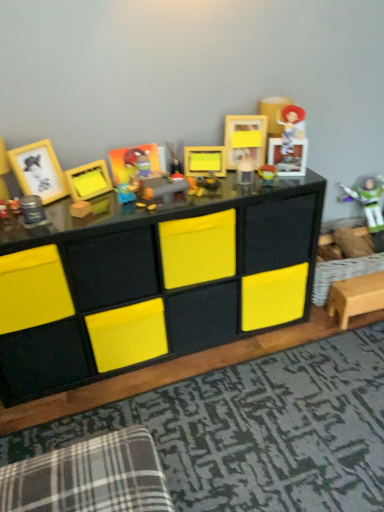
Where is `plaid fabric swivel chair at lower left`? The image size is (384, 512). plaid fabric swivel chair at lower left is located at coordinates (90, 477).

Where is `matte yellow plush toy at center, marked as the 4th toy in a back-to-front arrangement`? This screenshot has height=512, width=384. matte yellow plush toy at center, marked as the 4th toy in a back-to-front arrangement is located at coordinates (126, 193).

Image resolution: width=384 pixels, height=512 pixels. Find the location of `matte plastic picture frame at center, which ranks as the third picture frame in left-to-right order`. matte plastic picture frame at center, which ranks as the third picture frame in left-to-right order is located at coordinates (134, 162).

Describe the element at coordinates (134, 162) in the screenshot. The width and height of the screenshot is (384, 512). I see `matte plastic picture frame at center, the third picture frame viewed from the right` at that location.

Where is `plaid fabric swivel chair at lower left`? Image resolution: width=384 pixels, height=512 pixels. plaid fabric swivel chair at lower left is located at coordinates [90, 477].

From a real-world perspective, starting from the metallic silver canister at left, the fifth toy in the right-to-left sequence, which picture frame is the 5th one vertically above it? Please provide its 2D coordinates.

[(245, 139)]

Would you say matte yellow picture frame at upper center, marked as the fifth picture frame in a left-to-right arrangement, is outside metallic silver canister at left, the first toy when ordered from left to right?

Yes.

How many degrees apart are the facing directions of matte yellow picture frame at upper center, which is counted as the 1th picture frame, starting from the right, and metallic silver canister at left, which is the 5th toy in back-to-front order?

The facing directions of matte yellow picture frame at upper center, which is counted as the 1th picture frame, starting from the right, and metallic silver canister at left, which is the 5th toy in back-to-front order, are 39.1 degrees apart.

From the image's perspective, is yellow matte picture frame at center, the 4th picture frame from the left, above or below black matte storage unit at center?

yellow matte picture frame at center, the 4th picture frame from the left, is above black matte storage unit at center.

Who is bigger, yellow matte picture frame at center, the 2th picture frame positioned from the right, or black matte storage unit at center?

black matte storage unit at center.

Does yellow matte picture frame at center, the 2th picture frame positioned from the right, contain black matte storage unit at center?

No, black matte storage unit at center is not a part of yellow matte picture frame at center, the 2th picture frame positioned from the right.

Can you confirm if yellow matte picture frame at center, the 2th picture frame positioned from the right, is shorter than black matte storage unit at center?

Yes.

Looking at their sizes, would you say plastic buzz lightyear at right, which is counted as the first toy, starting from the right, is wider or thinner than matte yellow picture frame at left, marked as the first picture frame in a left-to-right arrangement?

plastic buzz lightyear at right, which is counted as the first toy, starting from the right, is wider than matte yellow picture frame at left, marked as the first picture frame in a left-to-right arrangement.

Considering the positions of objects plastic buzz lightyear at right, which is the 1th toy from back to front, and matte yellow picture frame at left, which is the fifth picture frame in right-to-left order, in the image provided, who is more to the left, plastic buzz lightyear at right, which is the 1th toy from back to front, or matte yellow picture frame at left, which is the fifth picture frame in right-to-left order,?

Positioned to the left is matte yellow picture frame at left, which is the fifth picture frame in right-to-left order.

How different are the orientations of plastic buzz lightyear at right, which is counted as the first toy, starting from the right, and matte yellow picture frame at left, which is the fifth picture frame in right-to-left order, in degrees?

The angle between the facing direction of plastic buzz lightyear at right, which is counted as the first toy, starting from the right, and the facing direction of matte yellow picture frame at left, which is the fifth picture frame in right-to-left order, is 34 degrees.

Which is less distant, (342,186) or (53,186)?

Point (342,186) is positioned farther from the camera compared to point (53,186).

At what (x,y) coordinates should I click in order to perform the action: click on toy that is the 4th object directly below the matte yellow picture frame at upper center, which is counted as the 1th picture frame, starting from the right (from a real-world perspective). Please return your answer as a coordinate pair (x, y). The width and height of the screenshot is (384, 512). Looking at the image, I should click on (126, 193).

From a real-world perspective, is matte yellow plush toy at center, marked as the 2th toy in a left-to-right arrangement, on top of matte yellow picture frame at upper center, marked as the fifth picture frame in a left-to-right arrangement?

Actually, matte yellow plush toy at center, marked as the 2th toy in a left-to-right arrangement, is physically below matte yellow picture frame at upper center, marked as the fifth picture frame in a left-to-right arrangement, in the real world.

How distant is matte yellow plush toy at center, marked as the 4th toy in a right-to-left arrangement, from matte yellow picture frame at upper center, which is counted as the 1th picture frame, starting from the right?

They are 20.74 inches apart.

What's the angular difference between matte yellow plush toy at center, acting as the second toy starting from the front, and matte yellow picture frame at upper center, marked as the fifth picture frame in a left-to-right arrangement,'s facing directions?

The angle between the facing direction of matte yellow plush toy at center, acting as the second toy starting from the front, and the facing direction of matte yellow picture frame at upper center, marked as the fifth picture frame in a left-to-right arrangement, is 51.1 degrees.

Which object is more forward, plaid fabric swivel chair at lower left or matte plastic buzz lightyear at center, arranged as the 3th toy when viewed from the left?

plaid fabric swivel chair at lower left.

Who is shorter, plaid fabric swivel chair at lower left or matte plastic buzz lightyear at center, marked as the 3th toy in a right-to-left arrangement?

Standing shorter between the two is matte plastic buzz lightyear at center, marked as the 3th toy in a right-to-left arrangement.

Looking at this image, considering the sizes of objects plaid fabric swivel chair at lower left and matte plastic buzz lightyear at center, which is the third toy in front-to-back order, in the image provided, who is bigger, plaid fabric swivel chair at lower left or matte plastic buzz lightyear at center, which is the third toy in front-to-back order,?

plaid fabric swivel chair at lower left is bigger.

Which object is further away from the camera, matte plastic figurine at upper right, the 4th toy when ordered from left to right, or metallic silver canister at left, the fifth toy in the right-to-left sequence?

Positioned behind is matte plastic figurine at upper right, the 4th toy when ordered from left to right.

Identify the location of the 3rd toy to the left of the matte plastic figurine at upper right, the second toy viewed from the right, starting your count from the anchor. (32, 211).

In the scene shown: Does matte plastic figurine at upper right, marked as the second toy in a back-to-front arrangement, appear on the right side of metallic silver canister at left, which is the 5th toy in back-to-front order?

Yes.

Considering the relative sizes of matte plastic figurine at upper right, the 4th toy when ordered from left to right, and metallic silver canister at left, the first toy when ordered from front to back, in the image provided, is matte plastic figurine at upper right, the 4th toy when ordered from left to right, bigger than metallic silver canister at left, the first toy when ordered from front to back,?

Indeed, matte plastic figurine at upper right, the 4th toy when ordered from left to right, has a larger size compared to metallic silver canister at left, the first toy when ordered from front to back.

Is metallic silver canister at left, which is the 5th toy in back-to-front order, taller than yellow matte picture frame at center, which is the fourth picture frame in right-to-left order?

No.

From a real-world perspective, is metallic silver canister at left, which is the 5th toy in back-to-front order, on top of yellow matte picture frame at center, which is the fourth picture frame in right-to-left order?

No, from a real-world perspective, metallic silver canister at left, which is the 5th toy in back-to-front order, is not above yellow matte picture frame at center, which is the fourth picture frame in right-to-left order.

Is metallic silver canister at left, the fifth toy in the right-to-left sequence, smaller than yellow matte picture frame at center, arranged as the 2th picture frame when viewed from the left?

Indeed, metallic silver canister at left, the fifth toy in the right-to-left sequence, has a smaller size compared to yellow matte picture frame at center, arranged as the 2th picture frame when viewed from the left.

Would you consider metallic silver canister at left, the fifth toy in the right-to-left sequence, to be distant from yellow matte picture frame at center, which is the fourth picture frame in right-to-left order?

metallic silver canister at left, the fifth toy in the right-to-left sequence, is actually quite close to yellow matte picture frame at center, which is the fourth picture frame in right-to-left order.

There is a matte yellow picture frame at upper center, marked as the fifth picture frame in a left-to-right arrangement. Identify the location of the 2nd toy below it (from a real-world perspective). (32, 211).

Identify the location of picture frame that is the 1st object above the black matte storage unit at center (from a real-world perspective). (205, 161).

Considering their positions, is matte plastic picture frame at center, which ranks as the third picture frame in left-to-right order, positioned further to black matte storage unit at center than matte plastic figurine at upper right, the second toy viewed from the right?

The object further to black matte storage unit at center is matte plastic figurine at upper right, the second toy viewed from the right.

From the image, which object appears to be farther from plaid fabric swivel chair at lower left, matte plastic buzz lightyear at center, which is counted as the 3th toy, starting from the back, or plastic buzz lightyear at right, which is counted as the first toy, starting from the right?

plastic buzz lightyear at right, which is counted as the first toy, starting from the right.

Considering their positions, is plaid fabric swivel chair at lower left positioned closer to matte yellow plush toy at center, marked as the 4th toy in a back-to-front arrangement, than plastic buzz lightyear at right, which is counted as the first toy, starting from the right?

Based on the image, plaid fabric swivel chair at lower left appears to be nearer to matte yellow plush toy at center, marked as the 4th toy in a back-to-front arrangement.

From the image, which object appears to be farther from black matte storage unit at center, matte plastic picture frame at center, which ranks as the third picture frame in left-to-right order, or matte yellow plush toy at center, marked as the 4th toy in a back-to-front arrangement?

matte yellow plush toy at center, marked as the 4th toy in a back-to-front arrangement, lies further to black matte storage unit at center than the other object.

When comparing their distances from matte yellow plush toy at center, marked as the 2th toy in a left-to-right arrangement, does matte plastic figurine at upper right, the 4th toy when ordered from left to right, or black matte storage unit at center seem closer?

The object closer to matte yellow plush toy at center, marked as the 2th toy in a left-to-right arrangement, is black matte storage unit at center.

Based on their spatial positions, is yellow matte picture frame at center, which is the fourth picture frame in right-to-left order, or matte plastic buzz lightyear at center, which is counted as the 3th toy, starting from the back, closer to plastic buzz lightyear at right, which is the 1th toy from back to front?

Among the two, matte plastic buzz lightyear at center, which is counted as the 3th toy, starting from the back, is located nearer to plastic buzz lightyear at right, which is the 1th toy from back to front.

Estimate the real-world distances between objects in this image. Which object is closer to matte yellow picture frame at left, marked as the first picture frame in a left-to-right arrangement, black matte storage unit at center or plastic buzz lightyear at right, which is counted as the first toy, starting from the right?

black matte storage unit at center lies closer to matte yellow picture frame at left, marked as the first picture frame in a left-to-right arrangement, than the other object.

Looking at the image, which one is located further to matte plastic figurine at upper right, the 4th toy when ordered from left to right, yellow matte picture frame at center, which is the fourth picture frame in right-to-left order, or yellow matte picture frame at center, the 2th picture frame positioned from the right?

yellow matte picture frame at center, which is the fourth picture frame in right-to-left order, is positioned further to the anchor matte plastic figurine at upper right, the 4th toy when ordered from left to right.

Locate an element on the screen. picture frame located between yellow matte picture frame at center, the 4th picture frame from the left, and matte plastic buzz lightyear at center, arranged as the 3th toy when viewed from the left, in the left-right direction is located at coordinates (245, 139).

Identify the location of toy between metallic silver canister at left, the first toy when ordered from front to back, and matte plastic buzz lightyear at center, which is counted as the 3th toy, starting from the back, in the horizontal direction. (126, 193).

The width and height of the screenshot is (384, 512). I want to click on picture frame between matte yellow picture frame at left, which is the fifth picture frame in right-to-left order, and matte yellow plush toy at center, marked as the 4th toy in a back-to-front arrangement, in the horizontal direction, so click(89, 181).

Find the location of a particular element. toy between yellow matte picture frame at center, arranged as the 2th picture frame when viewed from the left, and matte yellow picture frame at upper center, which is counted as the 1th picture frame, starting from the right, in the horizontal direction is located at coordinates (126, 193).